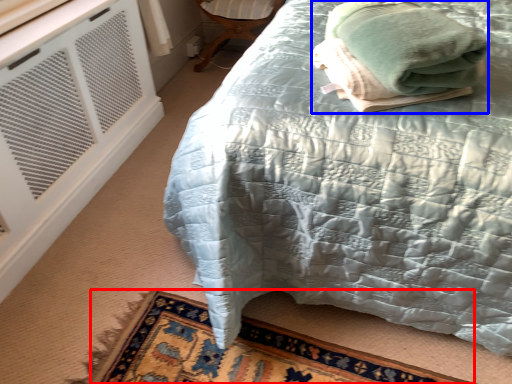
Question: Which object appears farthest to the camera in this image, mat (highlighted by a red box) or bath towel (highlighted by a blue box)?

Choices:
 (A) mat
 (B) bath towel

Answer: (A)